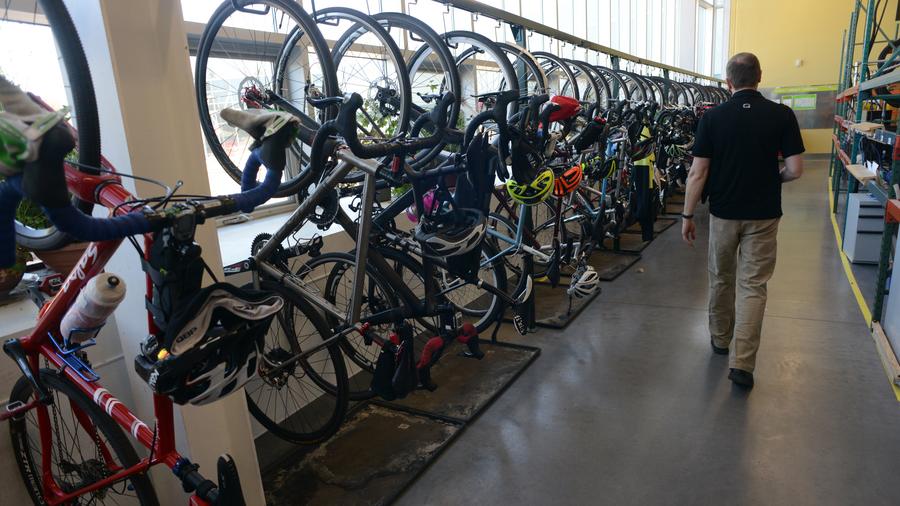
You are a GUI agent. You are given a task and a screenshot of the screen. Output one action in this format:
    pyautogui.click(x=<x>, y=<y>)
    Task: Click on the shelves
    
    Given the screenshot: What is the action you would take?
    870,228